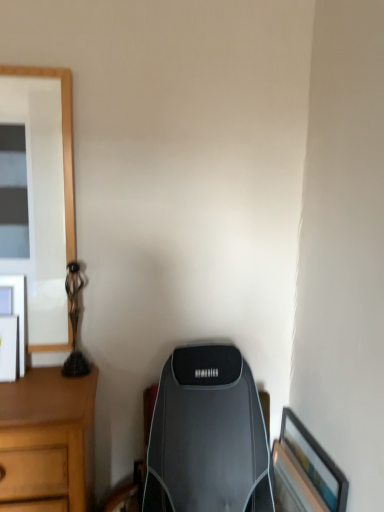
Question: Is the surface of wooden framed picture at lower right, which is counted as the 1th picture frame, starting from the right, in direct contact with matte black picture frame at left, which is the 2th picture frame in bottom-to-top order?

Choices:
 (A) no
 (B) yes

Answer: (A)

Question: Considering the relative sizes of wooden framed picture at lower right, which is the 2th picture frame in left-to-right order, and matte black picture frame at left, the 1th picture frame viewed from the top, in the image provided, is wooden framed picture at lower right, which is the 2th picture frame in left-to-right order, shorter than matte black picture frame at left, the 1th picture frame viewed from the top,?

Choices:
 (A) yes
 (B) no

Answer: (B)

Question: Is wooden framed picture at lower right, marked as the second picture frame in a top-to-bottom arrangement, facing towards matte black picture frame at left, the 1th picture frame viewed from the top?

Choices:
 (A) yes
 (B) no

Answer: (B)

Question: Is wooden framed picture at lower right, which is counted as the 1th picture frame, starting from the right, turned away from matte black picture frame at left, which is the 2th picture frame in bottom-to-top order?

Choices:
 (A) no
 (B) yes

Answer: (A)

Question: Considering the relative sizes of wooden framed picture at lower right, which is counted as the 1th picture frame, starting from the right, and matte black picture frame at left, the 1th picture frame viewed from the top, in the image provided, is wooden framed picture at lower right, which is counted as the 1th picture frame, starting from the right, smaller than matte black picture frame at left, the 1th picture frame viewed from the top,?

Choices:
 (A) no
 (B) yes

Answer: (A)

Question: Is matte black picture frame at left, which is the 2th picture frame in bottom-to-top order, bigger or smaller than bronze/statue at left?

Choices:
 (A) small
 (B) big

Answer: (A)

Question: Which is correct: matte black picture frame at left, the 1th picture frame viewed from the top, is inside bronze/statue at left, or outside of it?

Choices:
 (A) outside
 (B) inside

Answer: (A)

Question: From the image's perspective, relative to bronze/statue at left, is matte black picture frame at left, which is the 2th picture frame in bottom-to-top order, above or below?

Choices:
 (A) below
 (B) above

Answer: (A)

Question: Is point (23, 328) closer or farther from the camera than point (74, 282)?

Choices:
 (A) farther
 (B) closer

Answer: (B)

Question: Considering their positions, is matte black picture frame at left, the 1th picture frame viewed from the top, located in front of or behind wooden framed picture at lower right, the 1th picture frame in the bottom-to-top sequence?

Choices:
 (A) front
 (B) behind

Answer: (B)

Question: Considering the relative positions of matte black picture frame at left, which is the 2th picture frame from right to left, and wooden framed picture at lower right, which is counted as the 1th picture frame, starting from the right, in the image provided, is matte black picture frame at left, which is the 2th picture frame from right to left, to the left or to the right of wooden framed picture at lower right, which is counted as the 1th picture frame, starting from the right,?

Choices:
 (A) right
 (B) left

Answer: (B)

Question: From a real-world perspective, relative to wooden framed picture at lower right, marked as the second picture frame in a top-to-bottom arrangement, is matte black picture frame at left, the 1th picture frame viewed from the top, vertically above or below?

Choices:
 (A) above
 (B) below

Answer: (A)

Question: Based on their sizes in the image, would you say matte black picture frame at left, which is the 2th picture frame from right to left, is bigger or smaller than wooden framed picture at lower right, the 1th picture frame in the bottom-to-top sequence?

Choices:
 (A) small
 (B) big

Answer: (A)

Question: Based on their sizes in the image, would you say wooden framed picture at lower right, the 1th picture frame in the bottom-to-top sequence, is bigger or smaller than matte black picture frame at left, which is the 2th picture frame in bottom-to-top order?

Choices:
 (A) small
 (B) big

Answer: (B)

Question: In terms of height, does wooden framed picture at lower right, the 1th picture frame in the bottom-to-top sequence, look taller or shorter compared to matte black picture frame at left, the 1th picture frame viewed from the left?

Choices:
 (A) short
 (B) tall

Answer: (B)